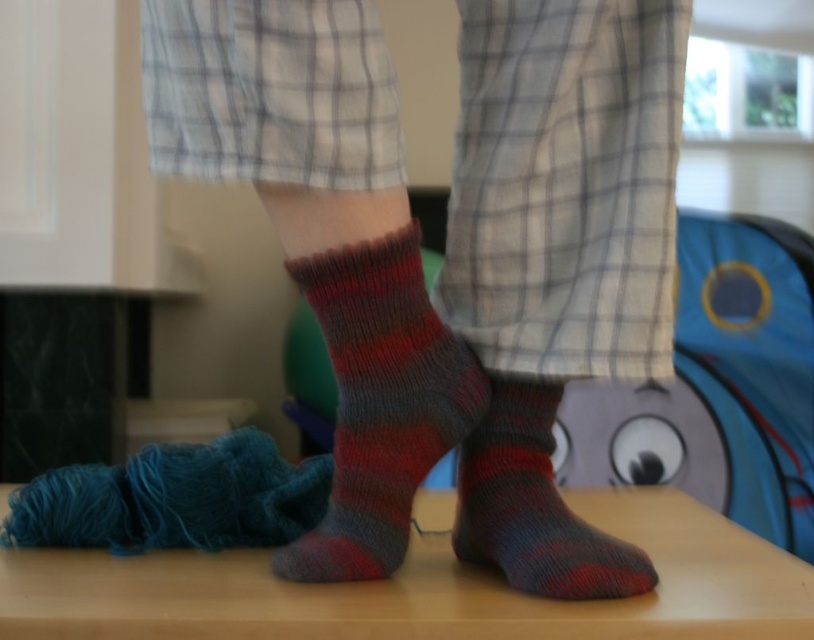
Which is more to the right, knitted woolen sock at center or knitted wool sock at center?

From the viewer's perspective, knitted wool sock at center appears more on the right side.

Consider the image. Does knitted woolen sock at center have a larger size compared to knitted wool sock at center?

Indeed, knitted woolen sock at center has a larger size compared to knitted wool sock at center.

Where is `knitted woolen sock at center`? knitted woolen sock at center is located at coordinates (379, 403).

I want to click on knitted woolen sock at center, so click(x=379, y=403).

Is knitted wool socks at center positioned behind knitted wool sock at center?

No, it is not.

Is knitted wool socks at center above knitted wool sock at center?

Indeed, knitted wool socks at center is positioned over knitted wool sock at center.

Which is in front, point (151, 60) or point (473, 460)?

Point (151, 60) is in front.

Locate an element on the screen. This screenshot has width=814, height=640. knitted wool socks at center is located at coordinates (449, 248).

In the scene shown: Does knitted wool socks at center have a greater width compared to knitted woolen sock at center?

Yes.

Does knitted wool socks at center appear on the right side of knitted woolen sock at center?

Yes, knitted wool socks at center is to the right of knitted woolen sock at center.

Is point (388, 321) closer to camera compared to point (440, 362)?

Yes, it is.

What are the coordinates of `knitted wool socks at center` in the screenshot? It's located at (449, 248).